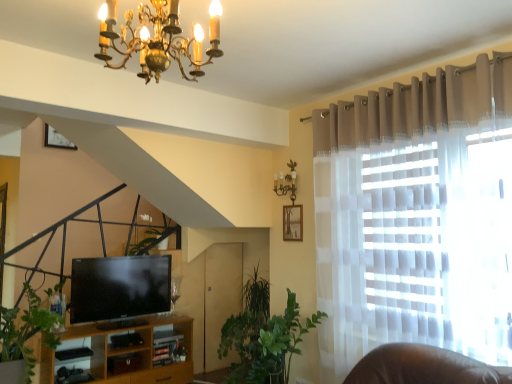
Consider the image. Measure the distance between point (492, 124) and camera.

Point (492, 124) is 2.51 meters away from camera.

The width and height of the screenshot is (512, 384). What do you see at coordinates (415, 216) in the screenshot?
I see `matte beige curtain at upper right` at bounding box center [415, 216].

Find the location of a particular element. This screenshot has width=512, height=384. matte beige curtain at upper right is located at coordinates (415, 216).

Describe the element at coordinates (283, 338) in the screenshot. I see `green leafy plant at center` at that location.

You are a GUI agent. You are given a task and a screenshot of the screen. Output one action in this format:
    pyautogui.click(x=<x>, y=<y>)
    Task: Click on the green leafy plant at center
    
    Given the screenshot: What is the action you would take?
    pyautogui.click(x=283, y=338)

Find the location of a particular element. The image size is (512, 384). matte beige curtain at upper right is located at coordinates (x=415, y=216).

Between green leafy plant at center and matte beige curtain at upper right, which one appears on the left side from the viewer's perspective?

From the viewer's perspective, green leafy plant at center appears more on the left side.

Consider the image. Is the depth of green leafy plant at center greater than that of matte beige curtain at upper right?

That is True.

Does point (298, 309) come closer to viewer compared to point (463, 255)?

That is False.

Based on the photo, from the image's perspective, relative to matte beige curtain at upper right, is green leafy plant at center above or below?

green leafy plant at center is below matte beige curtain at upper right.

From a real-world perspective, does green leafy plant at center sit lower than matte beige curtain at upper right?

Yes, from a real-world perspective, green leafy plant at center is under matte beige curtain at upper right.

Based on the photo, does green leafy plant at center have a greater width compared to matte beige curtain at upper right?

No, green leafy plant at center is not wider than matte beige curtain at upper right.

Considering the relative sizes of green leafy plant at center and matte beige curtain at upper right in the image provided, is green leafy plant at center shorter than matte beige curtain at upper right?

Yes.

Which of these two, green leafy plant at center or matte beige curtain at upper right, is smaller?

green leafy plant at center is smaller.

Consider the image. Is green leafy plant at center not inside matte beige curtain at upper right?

Yes, green leafy plant at center is located beyond the bounds of matte beige curtain at upper right.

Is there a large distance between green leafy plant at center and matte beige curtain at upper right?

green leafy plant at center is positioned a significant distance from matte beige curtain at upper right.

Is green leafy plant at center looking in the opposite direction of matte beige curtain at upper right?

No, green leafy plant at center is not facing away from matte beige curtain at upper right.

Can you tell me how much green leafy plant at center and matte beige curtain at upper right differ in facing direction?

They differ by 0.247 degrees in their facing directions.

Consider the image. Measure the distance from green leafy plant at center to matte beige curtain at upper right.

green leafy plant at center and matte beige curtain at upper right are 3.34 feet apart.

Where is `curtain above the green leafy plant at center (from a real-world perspective)`? This screenshot has width=512, height=384. curtain above the green leafy plant at center (from a real-world perspective) is located at coordinates (415, 216).

Consider the image. Is matte beige curtain at upper right at the right side of green leafy plant at center?

Correct, you'll find matte beige curtain at upper right to the right of green leafy plant at center.

Is the position of matte beige curtain at upper right less distant than that of green leafy plant at center?

Yes, matte beige curtain at upper right is closer to the viewer.

Which is behind, point (473, 90) or point (271, 375)?

The point (271, 375) is behind.

From the image's perspective, between matte beige curtain at upper right and green leafy plant at center, who is located below?

From the image's view, green leafy plant at center is below.

From a real-world perspective, who is located lower, matte beige curtain at upper right or green leafy plant at center?

green leafy plant at center.

Can you confirm if matte beige curtain at upper right is wider than green leafy plant at center?

Yes.

Considering the sizes of matte beige curtain at upper right and green leafy plant at center in the image, is matte beige curtain at upper right taller or shorter than green leafy plant at center?

matte beige curtain at upper right is taller than green leafy plant at center.

In the scene shown: Based on their sizes in the image, would you say matte beige curtain at upper right is bigger or smaller than green leafy plant at center?

matte beige curtain at upper right is bigger than green leafy plant at center.

Looking at this image, is matte beige curtain at upper right situated inside green leafy plant at center or outside?

matte beige curtain at upper right is not inside green leafy plant at center, it's outside.

In the scene shown: Is matte beige curtain at upper right with green leafy plant at center?

matte beige curtain at upper right is not next to green leafy plant at center, and they're not touching.

Could you tell me if matte beige curtain at upper right is turned towards green leafy plant at center?

No, matte beige curtain at upper right is not oriented towards green leafy plant at center.

Find the location of a particular element. Image resolution: width=512 pixels, height=384 pixels. curtain that appears above the green leafy plant at center (from a real-world perspective) is located at coordinates click(415, 216).

In order to click on curtain above the green leafy plant at center (from the image's perspective) in this screenshot , I will do `click(415, 216)`.

Where is `curtain above the green leafy plant at center (from a real-world perspective)`? curtain above the green leafy plant at center (from a real-world perspective) is located at coordinates (415, 216).